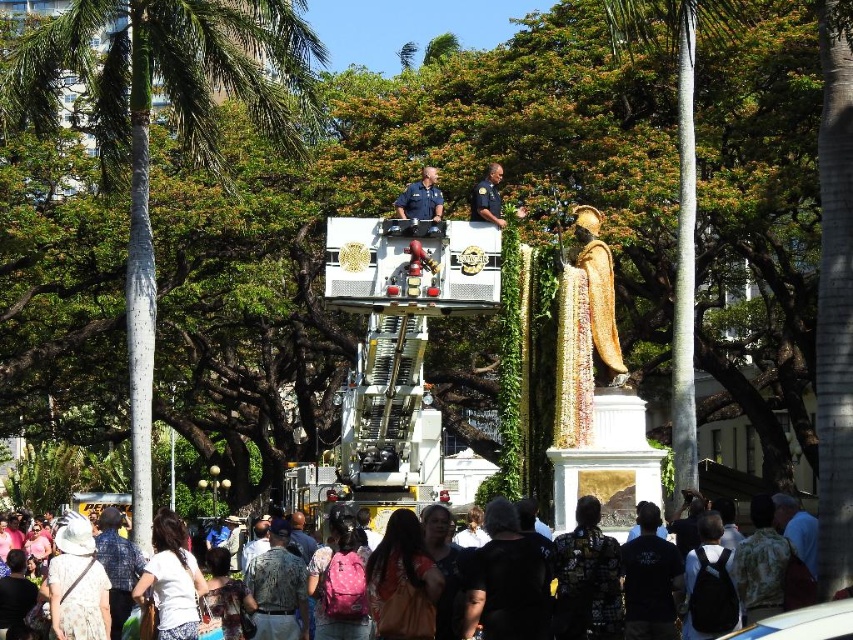
Question: Can you confirm if black cotton shirt at lower center is positioned to the right of flannel shirt at lower right?

Choices:
 (A) yes
 (B) no

Answer: (B)

Question: Does dark clothing crowd at lower center lie in front of gold textured robe at upper center?

Choices:
 (A) no
 (B) yes

Answer: (B)

Question: Which point is closer to the camera?

Choices:
 (A) (483, 200)
 (B) (631, 605)
 (C) (274, 595)
 (D) (462, 538)

Answer: (B)

Question: Which object is the closest to the flannel shirt at lower right?

Choices:
 (A) dark clothing crowd at lower center
 (B) blue uniform at center
 (C) dark blue uniform at center
 (D) green leafy palm tree at center

Answer: (C)

Question: Considering the real-world distances, which object is closest to the gold textured robe at upper center?

Choices:
 (A) green leafy palm tree at center
 (B) flannel shirt at lower right
 (C) patterned fabric shirt at center

Answer: (A)

Question: Considering the relative positions of green leafy palm tree at center and gold textured robe at upper center in the image provided, where is green leafy palm tree at center located with respect to gold textured robe at upper center?

Choices:
 (A) left
 (B) right

Answer: (B)